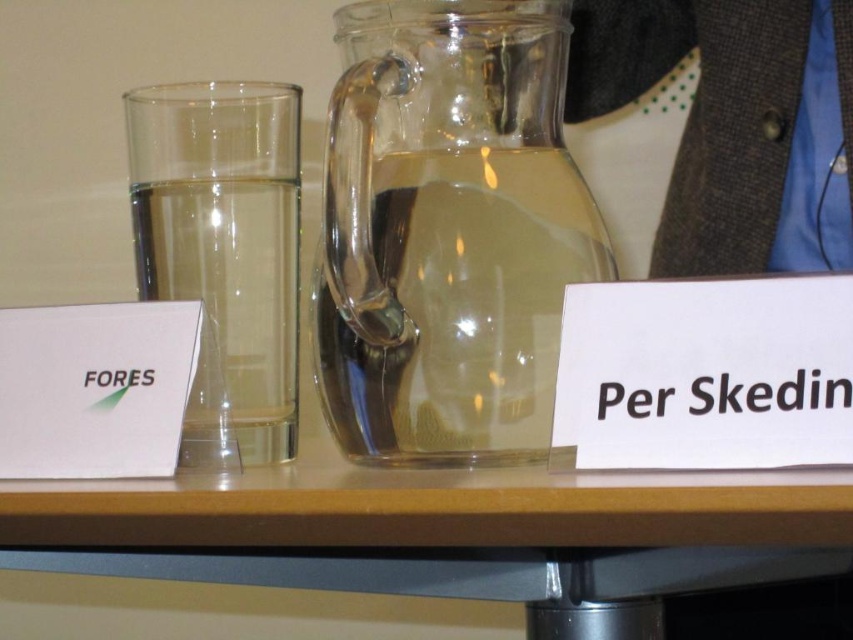
Does point (664, 390) come closer to viewer compared to point (102, 380)?

That is True.

Consider the image. Who is taller, black paper at right or green paper at left?

green paper at left

Does point (787, 410) come farther from viewer compared to point (91, 378)?

That is False.

This screenshot has width=853, height=640. Identify the location of black paper at right. (769, 394).

Which of these two, transparent glass jug at center or black paper at right, stands shorter?

With less height is black paper at right.

Locate an element on the screen. The height and width of the screenshot is (640, 853). transparent glass jug at center is located at coordinates (448, 230).

I want to click on clear glass pitcher at center, so click(x=224, y=248).

I want to click on clear glass pitcher at center, so click(224, 248).

Identify the location of clear glass pitcher at center. The width and height of the screenshot is (853, 640). (224, 248).